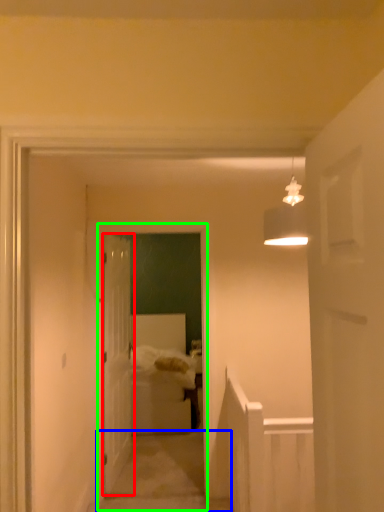
Question: Considering the real-world distances, which object is farthest from door (highlighted by a red box)? path (highlighted by a blue box) or corridor (highlighted by a green box)?

Choices:
 (A) path
 (B) corridor

Answer: (A)